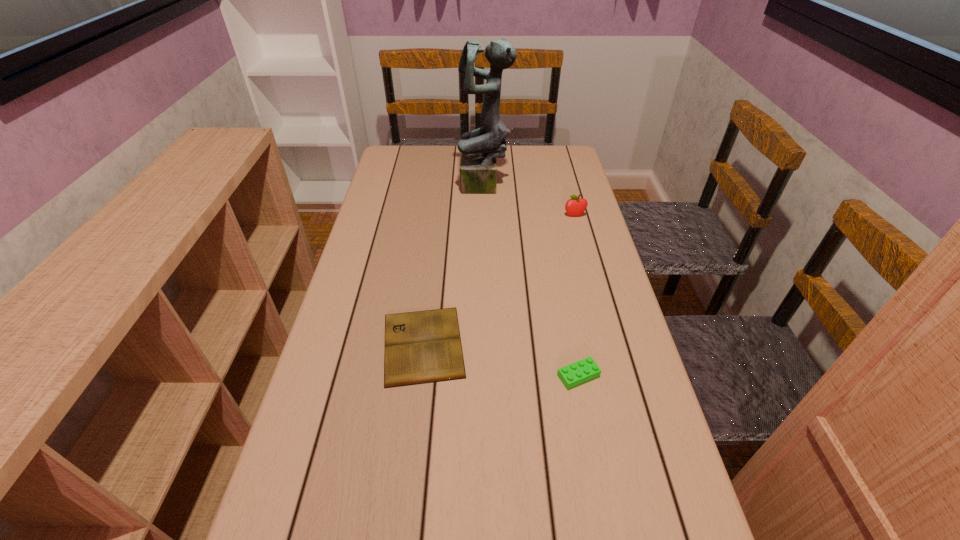
Select which object appears as the closest to the second shortest object. Please provide its 2D coordinates. Your answer should be formatted as a tuple, i.e. [(x, y)], where the tuple contains the x and y coordinates of a point satisfying the conditions above.

[(421, 347)]

Locate an element on the screen. This screenshot has height=540, width=960. free point that satisfies the following two spatial constraints: 1. on the back side of the second tallest object; 2. on the face of the farthest object is located at coordinates (567, 187).

This screenshot has height=540, width=960. Find the location of `vacant region that satisfies the following two spatial constraints: 1. on the face of the farthest object; 2. on the right side of the second object from right to left`. vacant region that satisfies the following two spatial constraints: 1. on the face of the farthest object; 2. on the right side of the second object from right to left is located at coordinates (488, 376).

This screenshot has width=960, height=540. Identify the location of vacant region that satisfies the following two spatial constraints: 1. on the face of the rightmost object; 2. on the right side of the sculpture. (485, 215).

Identify the location of free space in the image that satisfies the following two spatial constraints: 1. on the face of the Lego; 2. on the right side of the sculpture. (488, 376).

Locate an element on the screen. Image resolution: width=960 pixels, height=540 pixels. free spot that satisfies the following two spatial constraints: 1. on the face of the third tallest object; 2. on the right side of the sculpture is located at coordinates (488, 376).

Locate an element on the screen. This screenshot has width=960, height=540. free region that satisfies the following two spatial constraints: 1. on the face of the sculpture; 2. on the left side of the third object from left to right is located at coordinates (488, 376).